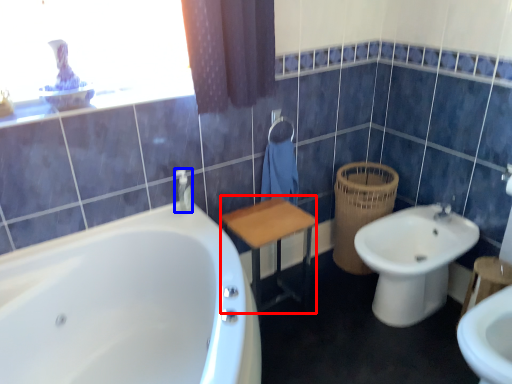
Question: Which of the following is the farthest to the observer, vanity (highlighted by a red box) or toiletry (highlighted by a blue box)?

Choices:
 (A) vanity
 (B) toiletry

Answer: (B)